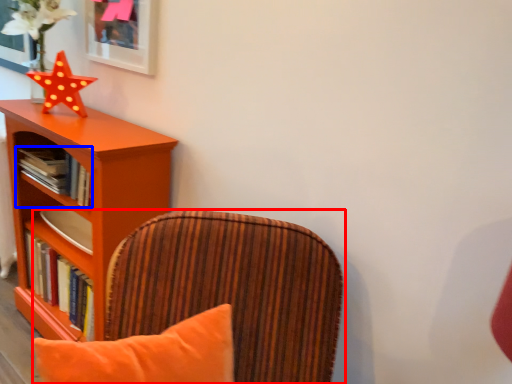
Question: Which of the following is the farthest to the observer, chair (highlighted by a red box) or book (highlighted by a blue box)?

Choices:
 (A) chair
 (B) book

Answer: (B)